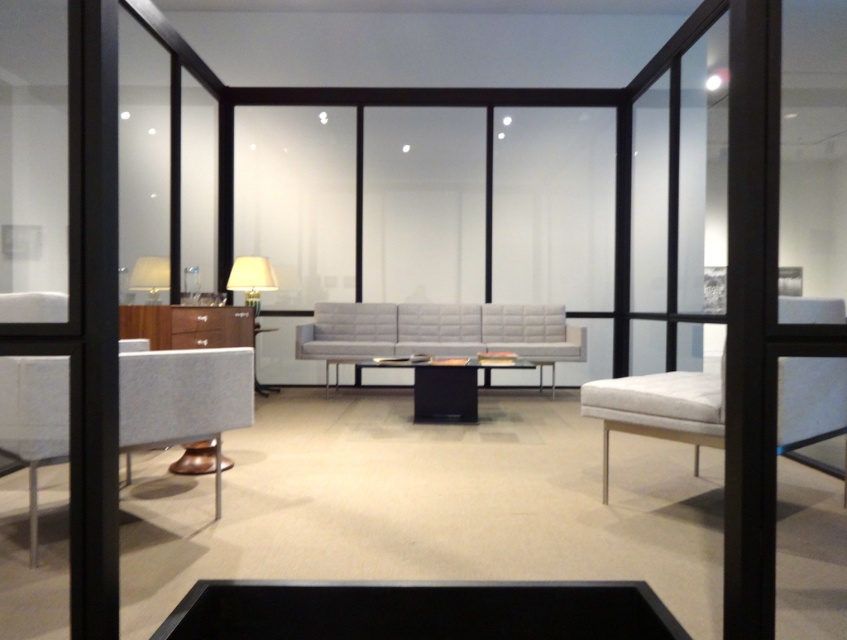
Question: Can you confirm if textured gray chair at left is positioned above black glossy table at center?

Choices:
 (A) no
 (B) yes

Answer: (B)

Question: Among these points, which one is nearest to the camera?

Choices:
 (A) (256, 324)
 (B) (169, 352)
 (C) (469, 408)
 (D) (164, 289)

Answer: (B)

Question: Does matte white lamp at upper center have a greater width compared to matte black coffee table at center?

Choices:
 (A) yes
 (B) no

Answer: (A)

Question: Does light gray quilted fabric couch at center lie behind matte black coffee table at center?

Choices:
 (A) no
 (B) yes

Answer: (B)

Question: Which object is positioned farthest from the matte white lamp at upper center?

Choices:
 (A) white fabric armchair at right
 (B) matte black coffee table at center

Answer: (A)

Question: Based on their relative distances, which object is nearer to the matte white lampshade at upper left?

Choices:
 (A) matte white lamp at upper center
 (B) black glossy table at center
 (C) white fabric armchair at right

Answer: (A)